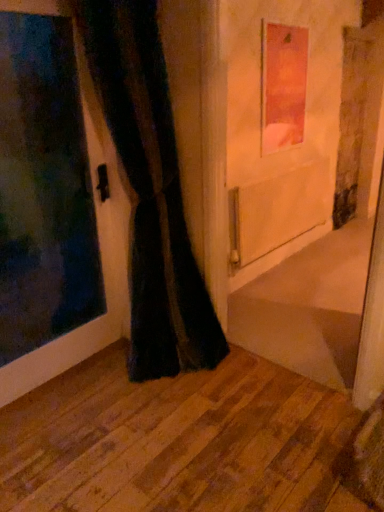
In order to face wooden floor at lower left, should I rotate leftwards or rightwards?

Turn left approximately 1.927 degrees to face it.

In order to click on wooden floor at lower left in this screenshot , I will do `click(177, 441)`.

The image size is (384, 512). What do you see at coordinates (177, 441) in the screenshot? I see `wooden floor at lower left` at bounding box center [177, 441].

What is the approximate width of matte pink picture frame at upper center?

matte pink picture frame at upper center is 3.17 inches in width.

What is the approximate height of matte pink picture frame at upper center?

The height of matte pink picture frame at upper center is 35.48 inches.

What are the coordinates of `matte pink picture frame at upper center` in the screenshot? It's located at (283, 85).

This screenshot has width=384, height=512. What do you see at coordinates (283, 85) in the screenshot?
I see `matte pink picture frame at upper center` at bounding box center [283, 85].

Measure the distance between matte pink picture frame at upper center and camera.

A distance of 9.09 feet exists between matte pink picture frame at upper center and camera.

Consider the image. Measure the distance between point (277, 150) and camera.

Point (277, 150) is 3.18 meters from camera.

You are a GUI agent. You are given a task and a screenshot of the screen. Output one action in this format:
    pyautogui.click(x=<x>, y=<y>)
    Task: Click on the wooden floor at lower left
    The height and width of the screenshot is (512, 384).
    Given the screenshot: What is the action you would take?
    pyautogui.click(x=177, y=441)

Visually, is wooden floor at lower left positioned to the left or to the right of matte pink picture frame at upper center?

wooden floor at lower left is positioned on matte pink picture frame at upper center's left side.

Which object is more forward, wooden floor at lower left or matte pink picture frame at upper center?

wooden floor at lower left.

Which is less distant, (125,424) or (303,99)?

Clearly, point (125,424) is closer to the camera than point (303,99).

From the image's perspective, is wooden floor at lower left on top of matte pink picture frame at upper center?

No, from the image's perspective, wooden floor at lower left is not over matte pink picture frame at upper center.

From a real-world perspective, which is physically below, wooden floor at lower left or matte pink picture frame at upper center?

From a 3D spatial view, wooden floor at lower left is below.

In the scene shown: Which of these two, wooden floor at lower left or matte pink picture frame at upper center, is thinner?

matte pink picture frame at upper center is thinner.

Is wooden floor at lower left taller or shorter than matte pink picture frame at upper center?

In the image, wooden floor at lower left appears to be shorter than matte pink picture frame at upper center.

Can you confirm if wooden floor at lower left is bigger than matte pink picture frame at upper center?

Yes, wooden floor at lower left is bigger than matte pink picture frame at upper center.

Would you say matte pink picture frame at upper center is part of wooden floor at lower left's contents?

No, matte pink picture frame at upper center is not a part of wooden floor at lower left.

Are wooden floor at lower left and matte pink picture frame at upper center located far from each other?

That's right, there is a large distance between wooden floor at lower left and matte pink picture frame at upper center.

Is matte pink picture frame at upper center at the back of wooden floor at lower left?

That's not correct — wooden floor at lower left is not looking away from matte pink picture frame at upper center.

Locate an element on the screen. picture frame above the wooden floor at lower left (from the image's perspective) is located at coordinates (283, 85).

Would you say matte pink picture frame at upper center is to the left or to the right of wooden floor at lower left in the picture?

In the image, matte pink picture frame at upper center appears on the right side of wooden floor at lower left.

Is matte pink picture frame at upper center positioned before wooden floor at lower left?

No, matte pink picture frame at upper center is behind wooden floor at lower left.

Between point (271, 31) and point (143, 436), which one is positioned in front?

The point (143, 436) is closer.

From the image's perspective, is matte pink picture frame at upper center below wooden floor at lower left?

No.

From a real-world perspective, is matte pink picture frame at upper center below wooden floor at lower left?

No, from a real-world perspective, matte pink picture frame at upper center is not beneath wooden floor at lower left.

Between matte pink picture frame at upper center and wooden floor at lower left, which one has smaller width?

matte pink picture frame at upper center.

Does matte pink picture frame at upper center have a lesser height compared to wooden floor at lower left?

In fact, matte pink picture frame at upper center may be taller than wooden floor at lower left.

Is matte pink picture frame at upper center bigger or smaller than wooden floor at lower left?

matte pink picture frame at upper center is smaller than wooden floor at lower left.

Choose the correct answer: Is matte pink picture frame at upper center inside wooden floor at lower left or outside it?

matte pink picture frame at upper center is spatially situated outside wooden floor at lower left.

Is matte pink picture frame at upper center not close to wooden floor at lower left?

matte pink picture frame at upper center is far away from wooden floor at lower left.

Is wooden floor at lower left at the back of matte pink picture frame at upper center?

matte pink picture frame at upper center is not turned away from wooden floor at lower left.

Can you tell me how much matte pink picture frame at upper center and wooden floor at lower left differ in facing direction?

The facing directions of matte pink picture frame at upper center and wooden floor at lower left are 88 degrees apart.

The height and width of the screenshot is (512, 384). What are the coordinates of `picture frame behind the wooden floor at lower left` in the screenshot? It's located at (283, 85).

Identify the location of corridor on the left of matte pink picture frame at upper center. The height and width of the screenshot is (512, 384). (177, 441).

At what (x,y) coordinates should I click in order to perform the action: click on corridor in front of the matte pink picture frame at upper center. Please return your answer as a coordinate pair (x, y). This screenshot has width=384, height=512. Looking at the image, I should click on (177, 441).